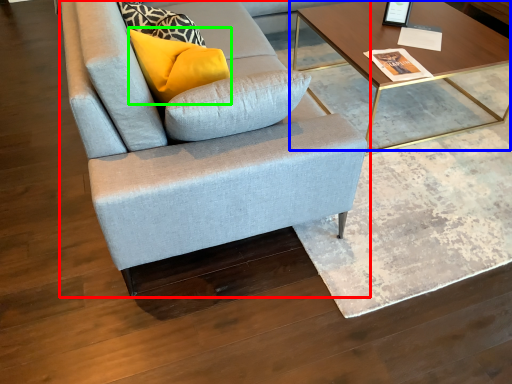
Question: Based on their relative distances, which object is nearer to studio couch (highlighted by a red box)? Choose from coffee table (highlighted by a blue box) and pillow (highlighted by a green box).

Choices:
 (A) coffee table
 (B) pillow

Answer: (B)